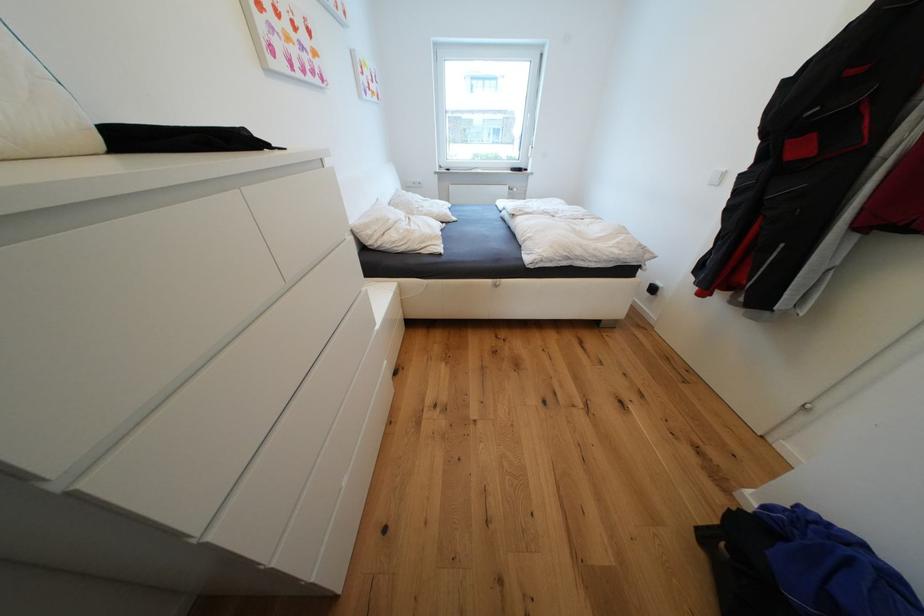
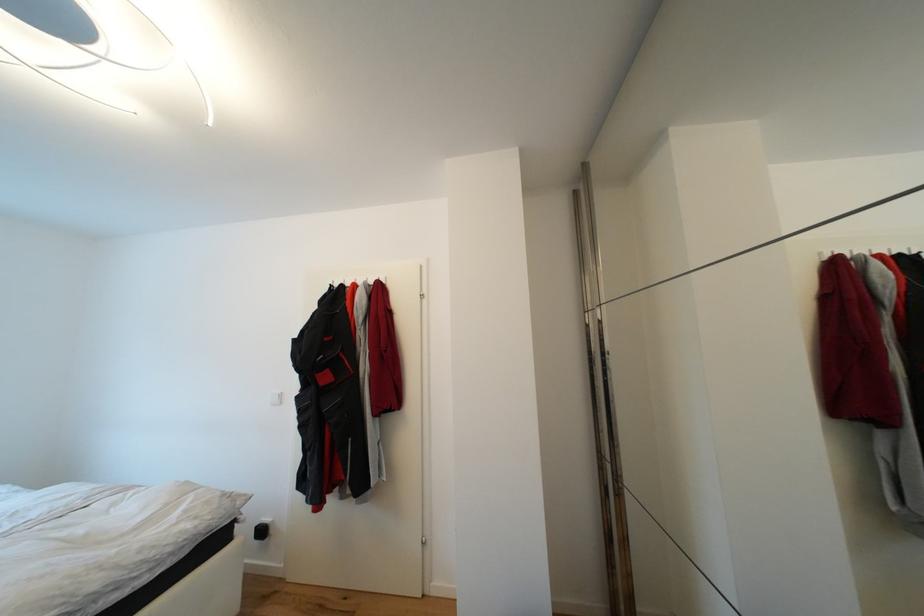
Question: The camera is either moving clockwise (left) or counter-clockwise (right) around the object. The first image is from the beginning of the video and the second image is from the end. Is the camera moving left or right when shooting the video?

Choices:
 (A) Left
 (B) Right

Answer: (A)